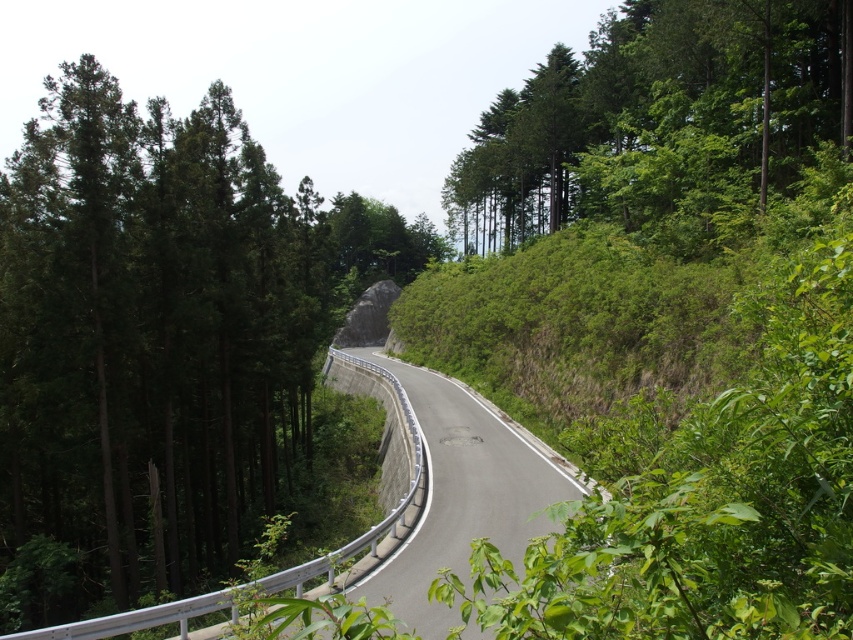
You are a hiker standing at the center of the winding road in the forest. You want to take a photo of the green leafy trees at upper right. In which direction should you point your camera?

The green leafy trees at upper right are located at point (659, 120). Since the coordinates are in the upper right quadrant, you should point your camera towards the upper right direction to capture them.

You are driving along the winding road and notice two groups of trees ahead. One is the green matte tree at left and the other is the green leafy trees at upper right. Which group of trees will appear closer to you as you continue driving forward?

The green matte tree at left will appear closer to you because it is positioned closer to the viewer compared to the green leafy trees at upper right, which are farther away in the distance.